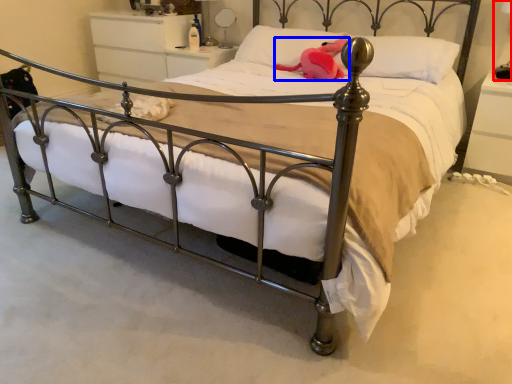
Question: Which point is closer to the camera, table lamp (highlighted by a red box) or animal (highlighted by a blue box)?

Choices:
 (A) table lamp
 (B) animal

Answer: (A)